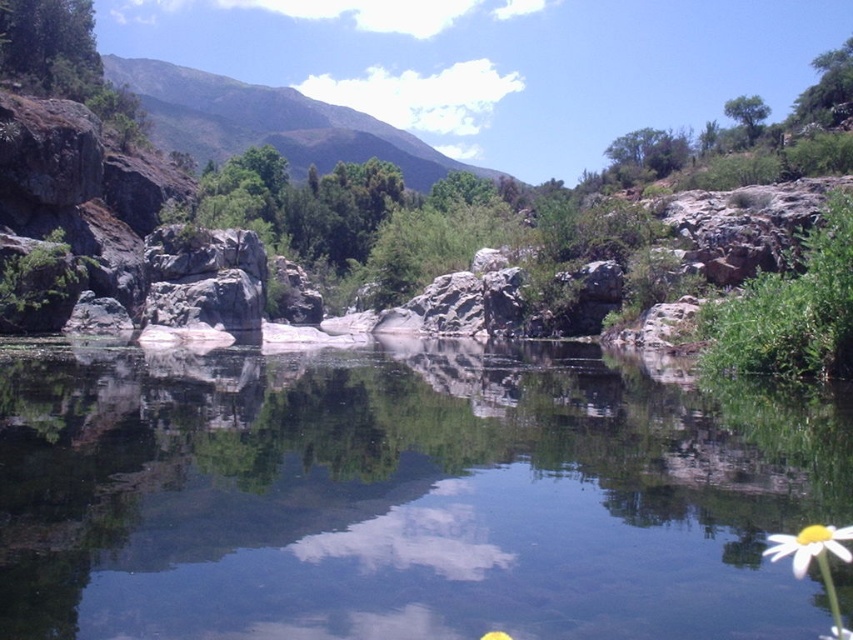
Question: Which point appears closest to the camera in this image?

Choices:
 (A) (198, 310)
 (B) (328, 147)
 (C) (770, 557)

Answer: (C)

Question: From the image, what is the correct spatial relationship of green grassy mountain at upper center in relation to gray rock at center?

Choices:
 (A) above
 (B) below

Answer: (A)

Question: Is green grassy mountain at upper center smaller than white matte flower at lower right?

Choices:
 (A) yes
 (B) no

Answer: (B)

Question: Among these points, which one is farthest from the camera?

Choices:
 (A) (672, 484)
 (B) (392, 150)
 (C) (817, 534)

Answer: (B)

Question: Which of the following is the closest to the observer?

Choices:
 (A) gray rock at center
 (B) green grassy mountain at upper center
 (C) clear water at center
 (D) white matte flower at lower right

Answer: (D)

Question: Can you confirm if gray rock at center is positioned to the left of white matte flower at lower right?

Choices:
 (A) no
 (B) yes

Answer: (B)